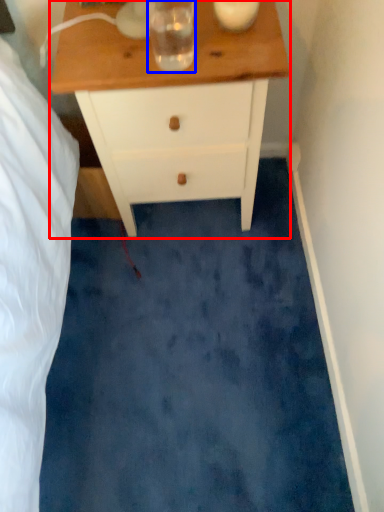
Question: Among these objects, which one is farthest to the camera, chest of drawers (highlighted by a red box) or beverage (highlighted by a blue box)?

Choices:
 (A) chest of drawers
 (B) beverage

Answer: (A)